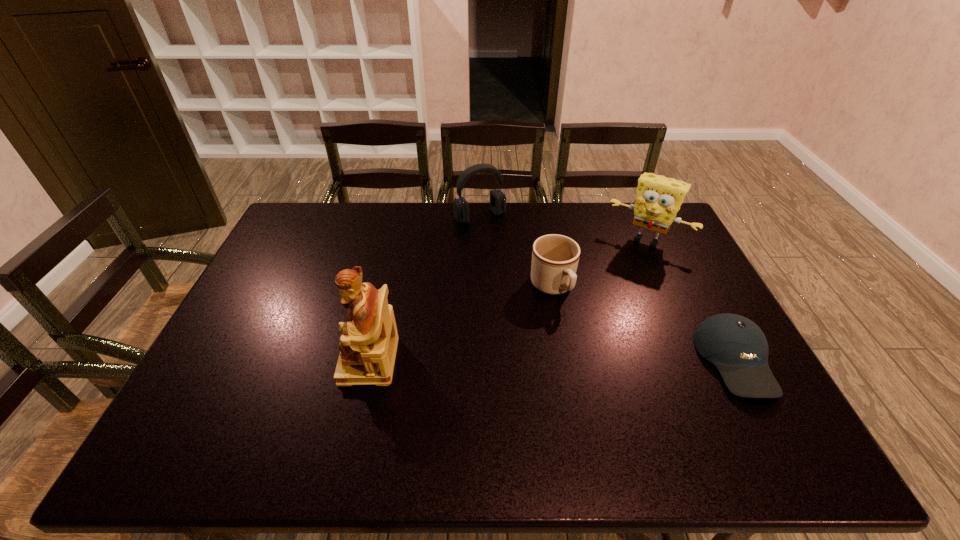
Where is `free space located on the side of the third farthest object with the handle`? Image resolution: width=960 pixels, height=540 pixels. free space located on the side of the third farthest object with the handle is located at coordinates (591, 347).

Identify the location of vacant area situated on the side of the third farthest object with the handle. (615, 383).

Find the location of `vacant space located 0.130m on the side of the third farthest object with the handle`. vacant space located 0.130m on the side of the third farthest object with the handle is located at coordinates (586, 339).

This screenshot has width=960, height=540. Identify the location of vacant area situated on the headband of the second object from left to right. (529, 279).

At what (x,y) coordinates should I click in order to perform the action: click on free spot located on the headband of the second object from left to right. Please return your answer as a coordinate pair (x, y). The width and height of the screenshot is (960, 540). Looking at the image, I should click on (497, 236).

You are a GUI agent. You are given a task and a screenshot of the screen. Output one action in this format:
    pyautogui.click(x=<x>, y=<y>)
    Task: Click on the free space located 0.200m on the headband of the second object from left to right
    
    Given the screenshot: What is the action you would take?
    pyautogui.click(x=515, y=260)

At what (x,y) coordinates should I click in order to perform the action: click on free spot located 0.220m on the face of the sponge. Please return your answer as a coordinate pair (x, y). This screenshot has height=540, width=960. Looking at the image, I should click on (610, 293).

Locate an element on the screen. The height and width of the screenshot is (540, 960). free space located 0.320m on the face of the sponge is located at coordinates (598, 314).

Where is `vacant space situated 0.300m on the face of the sponge`? Image resolution: width=960 pixels, height=540 pixels. vacant space situated 0.300m on the face of the sponge is located at coordinates (600, 309).

What are the coordinates of `headset present at the far edge` in the screenshot? It's located at (497, 198).